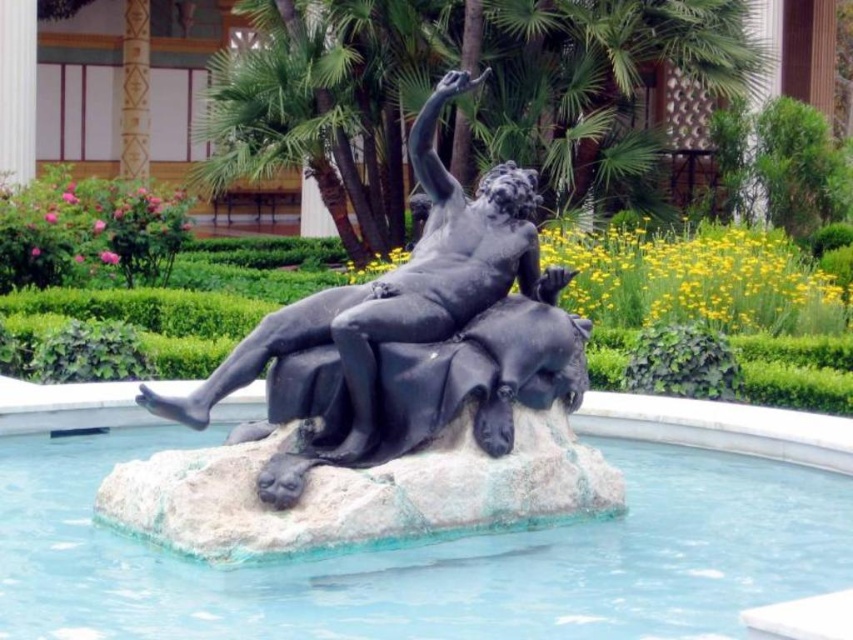
Is smooth stone pool at center wider than green leafy palm tree at upper center?

In fact, smooth stone pool at center might be narrower than green leafy palm tree at upper center.

Is the position of smooth stone pool at center more distant than that of green leafy palm tree at upper center?

That is False.

The image size is (853, 640). Describe the element at coordinates (445, 541) in the screenshot. I see `smooth stone pool at center` at that location.

Find the location of `smooth stone pool at center`. smooth stone pool at center is located at coordinates (445, 541).

Who is taller, green leafy palm tree at upper center or polished bronze statue at center?

green leafy palm tree at upper center is taller.

From the picture: Which is below, green leafy palm tree at upper center or polished bronze statue at center?

polished bronze statue at center

Who is more forward, (x=604, y=44) or (x=476, y=312)?

Positioned in front is point (x=476, y=312).

Where is `green leafy palm tree at upper center`? green leafy palm tree at upper center is located at coordinates (328, 104).

Is smooth stone pool at center to the left of polished bronze statue at center from the viewer's perspective?

In fact, smooth stone pool at center is to the right of polished bronze statue at center.

Who is more distant from viewer, [664,538] or [289,408]?

The point [664,538] is more distant.

Image resolution: width=853 pixels, height=640 pixels. Identify the location of smooth stone pool at center. (445, 541).